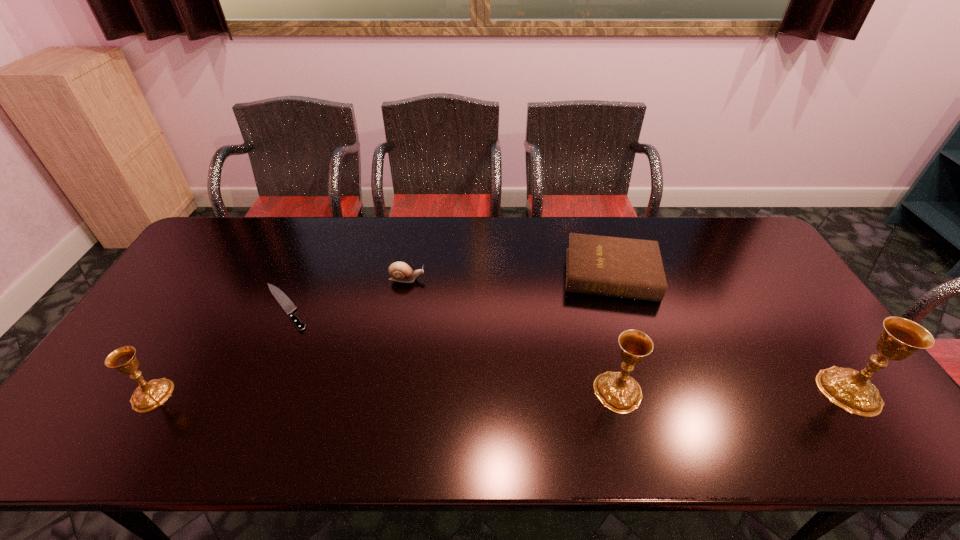
If the aim is uniform spacing by inserting an additional chalice among them, please point to a vacant space for this new chalice. Please provide its 2D coordinates. Your answer should be formatted as a tuple, i.e. [(x, y)], where the tuple contains the x and y coordinates of a point satisfying the conditions above.

[(386, 393)]